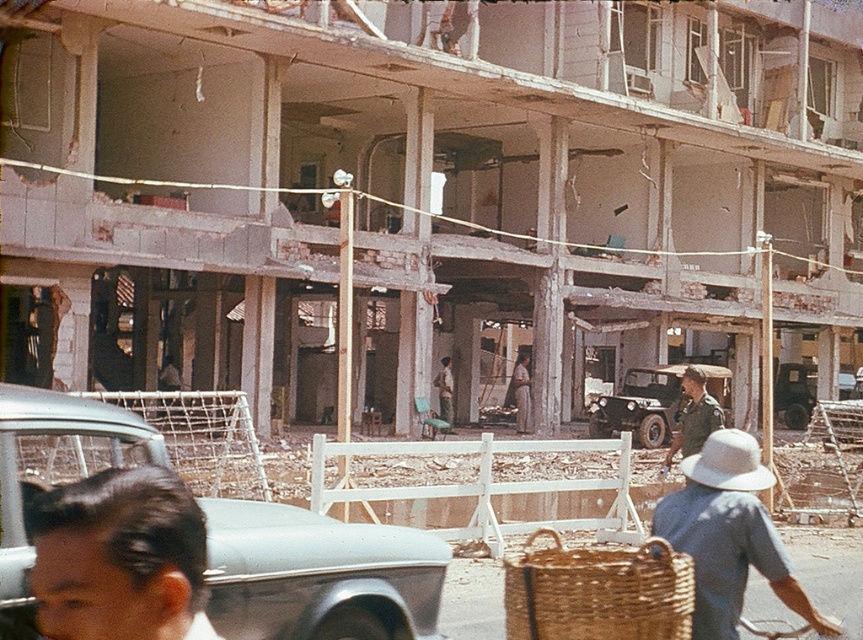
Question: Estimate the real-world distances between objects in this image. Which object is farther from the woven brown basket at lower center?

Choices:
 (A) black hair at lower left
 (B) light brown fabric dress at center

Answer: (B)

Question: Estimate the real-world distances between objects in this image. Which object is closer to the white straw hat at lower right?

Choices:
 (A) green matte jeep at center
 (B) light brown fabric dress at center

Answer: (A)

Question: Is camouflage uniform at center to the right of light brown fabric skirt at center from the viewer's perspective?

Choices:
 (A) no
 (B) yes

Answer: (B)

Question: Is camouflage uniform at center wider than light brown fabric dress at center?

Choices:
 (A) no
 (B) yes

Answer: (B)

Question: Can you confirm if green matte jeep at center is positioned below light brown fabric dress at center?

Choices:
 (A) no
 (B) yes

Answer: (B)

Question: Based on their relative distances, which object is nearer to the silver metallic car at center?

Choices:
 (A) light brown fabric skirt at center
 (B) white straw hat at lower right
 (C) light brown fabric dress at center
 (D) black hair at lower left

Answer: (B)